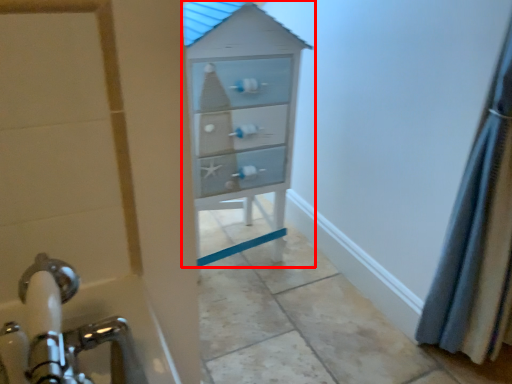
Question: Where is chest of drawers (annotated by the red box) located in relation to shower curtain in the image?

Choices:
 (A) left
 (B) right

Answer: (A)